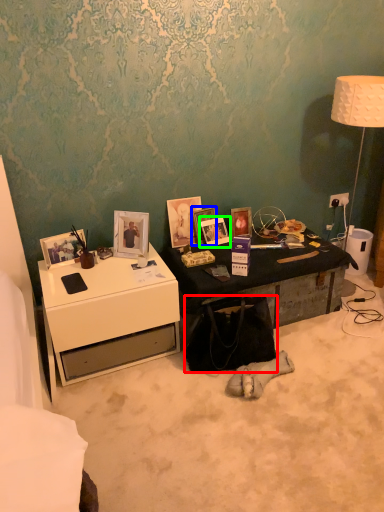
Question: Estimate the real-world distances between objects in this image. Which object is closer to handbag (highlighted by a red box), picture frame (highlighted by a blue box) or picture frame (highlighted by a green box)?

Choices:
 (A) picture frame
 (B) picture frame

Answer: (B)